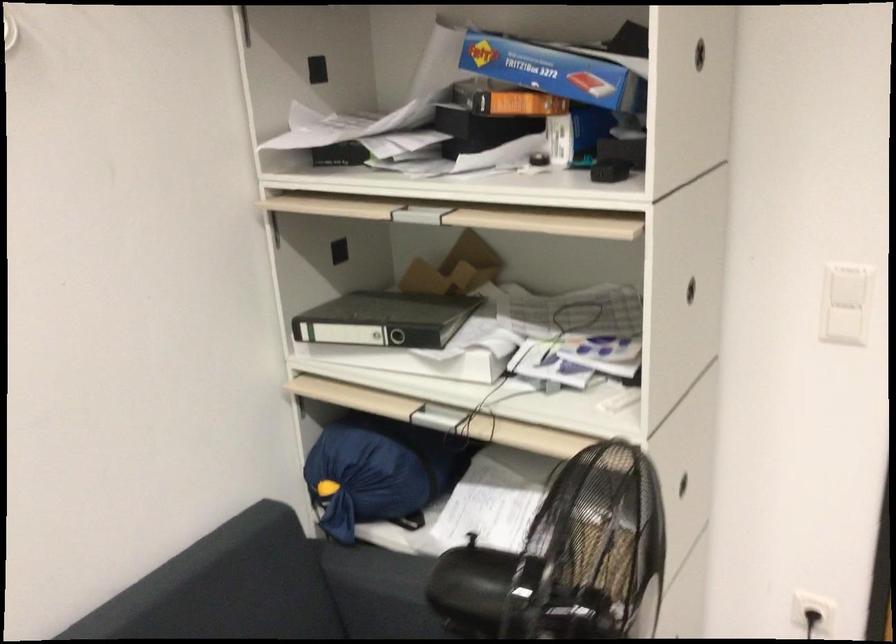
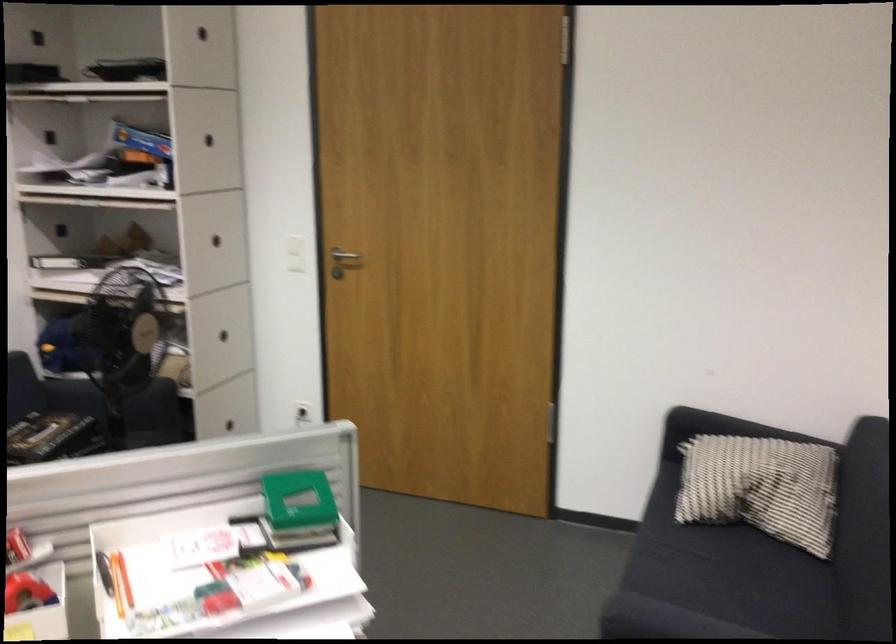
Where in the second image is the point corresponding to the point at 385,319 from the first image?

(76, 256)